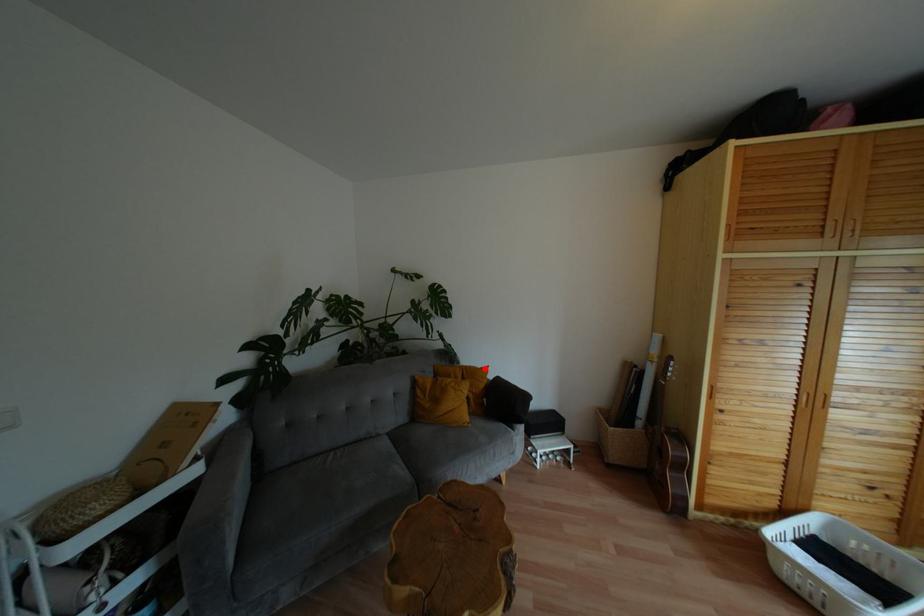
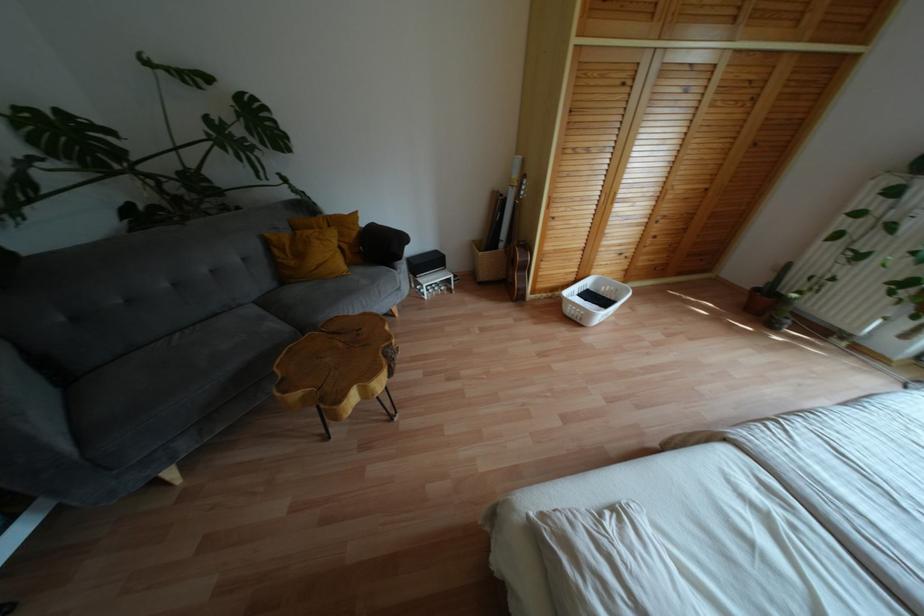
Question: I am providing you with two images of the same scene from different viewpoints. Image1 has a red point marked. In image2, the corresponding 3D location appears at what relative position? Reply with the corresponding letter.

Choices:
 (A) Closer
 (B) Farther

Answer: (A)